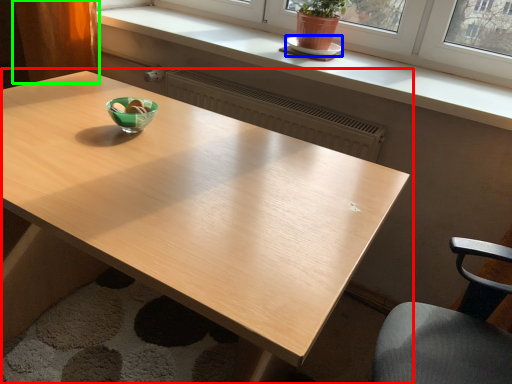
Question: Which object is the closest to the table (highlighted by a red box)? Choose among these: saucer (highlighted by a blue box) or curtain (highlighted by a green box).

Choices:
 (A) saucer
 (B) curtain

Answer: (B)